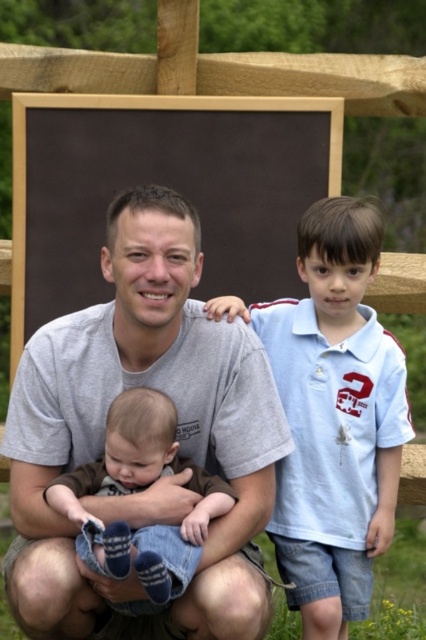
Question: Is gray cotton t-shirt at center to the right of light blue cotton shirt at right from the viewer's perspective?

Choices:
 (A) no
 (B) yes

Answer: (A)

Question: Which object is farther from the camera taking this photo?

Choices:
 (A) soft brown fabric baby at center
 (B) gray cotton t-shirt at center
 (C) light blue cotton shirt at right

Answer: (C)

Question: Considering the relative positions of gray cotton t-shirt at center and soft brown fabric baby at center in the image provided, where is gray cotton t-shirt at center located with respect to soft brown fabric baby at center?

Choices:
 (A) left
 (B) right

Answer: (B)

Question: Which of the following is the closest to the observer?

Choices:
 (A) light blue cotton shirt at right
 (B) gray cotton t-shirt at center

Answer: (B)

Question: Is gray cotton t-shirt at center bigger than light blue cotton shirt at right?

Choices:
 (A) no
 (B) yes

Answer: (B)

Question: Which is farther from the light blue cotton shirt at right?

Choices:
 (A) soft brown fabric baby at center
 (B) gray cotton t-shirt at center

Answer: (A)